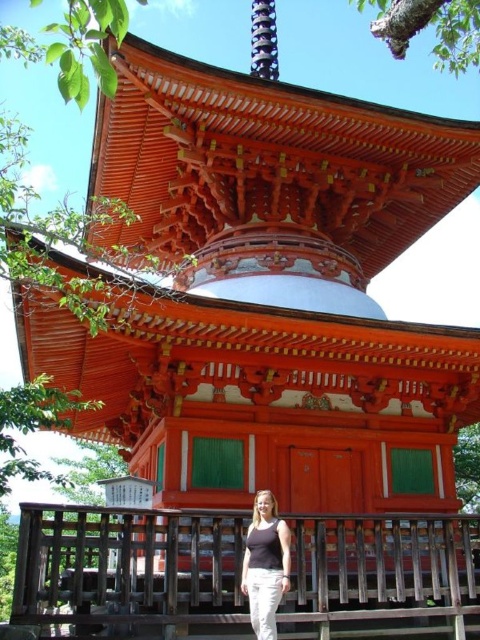
Question: Which of the following is the closest to the observer?

Choices:
 (A) (259, 573)
 (B) (310, 563)

Answer: (A)

Question: Does brown wooden rail at lower center appear on the right side of matte black tank top at center?

Choices:
 (A) yes
 (B) no

Answer: (B)

Question: Which point appears farthest from the camera in this image?

Choices:
 (A) (276, 609)
 (B) (463, 608)

Answer: (B)

Question: Can you confirm if brown wooden rail at lower center is thinner than matte black tank top at center?

Choices:
 (A) yes
 (B) no

Answer: (B)

Question: Does brown wooden rail at lower center appear over matte black tank top at center?

Choices:
 (A) no
 (B) yes

Answer: (A)

Question: Which point is farther from the camera taking this photo?

Choices:
 (A) (60, 557)
 (B) (289, 568)

Answer: (A)